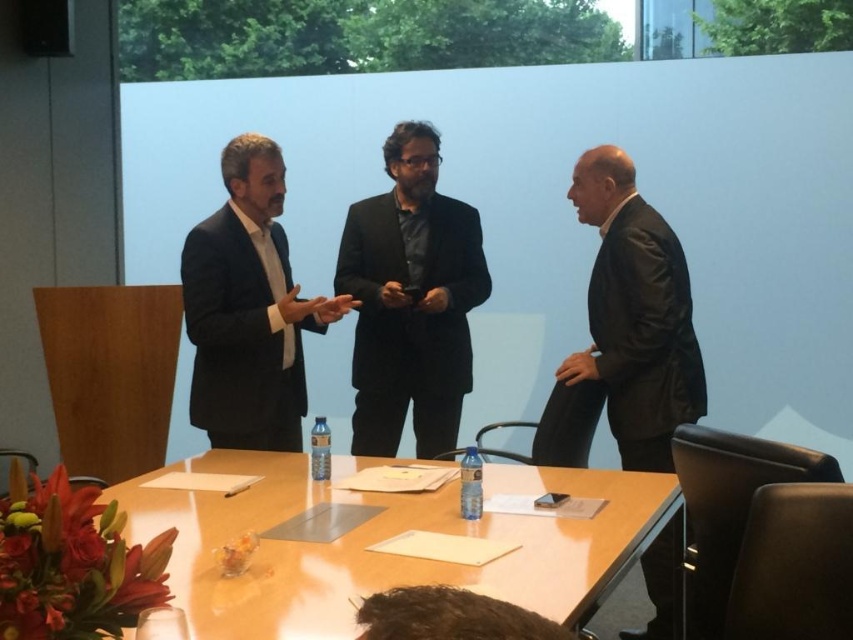
From the picture: Can you confirm if wooden table at center is positioned to the right of black leather jacket at right?

Incorrect, wooden table at center is not on the right side of black leather jacket at right.

Does wooden table at center have a lesser width compared to black leather jacket at right?

In fact, wooden table at center might be wider than black leather jacket at right.

This screenshot has width=853, height=640. I want to click on wooden table at center, so click(x=381, y=540).

Between wooden table at center and matte black suit at center, which one has less height?

With less height is wooden table at center.

Between wooden table at center and matte black suit at center, which one appears on the right side from the viewer's perspective?

wooden table at center

Between point (361, 563) and point (320, 326), which one is positioned behind?

The point (320, 326) is behind.

Locate an element on the screen. The height and width of the screenshot is (640, 853). wooden table at center is located at coordinates (381, 540).

Between black leather jacket at right and matte black suit at center, which one has more height?

black leather jacket at right

Does black leather jacket at right have a greater width compared to matte black suit at center?

Indeed, black leather jacket at right has a greater width compared to matte black suit at center.

Where is `black leather jacket at right`? black leather jacket at right is located at coordinates (625, 330).

This screenshot has height=640, width=853. In order to click on black leather jacket at right in this screenshot , I will do (625, 330).